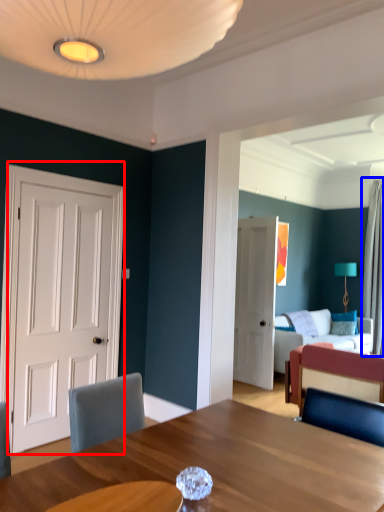
Question: Among these objects, which one is farthest to the camera, door (highlighted by a red box) or curtain (highlighted by a blue box)?

Choices:
 (A) door
 (B) curtain

Answer: (B)